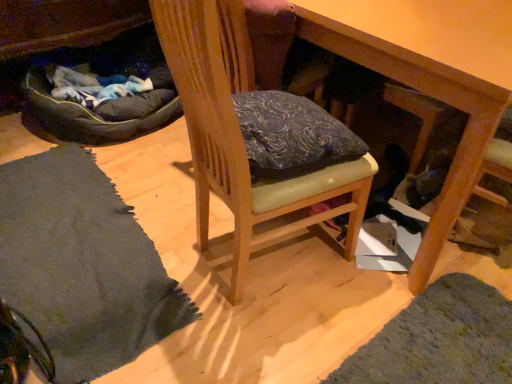
Locate an element on the screen. The height and width of the screenshot is (384, 512). unoccupied region to the right of wooden chair at center is located at coordinates (386, 297).